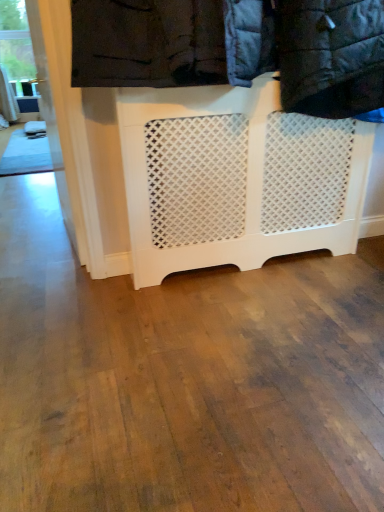
What do you see at coordinates (16, 41) in the screenshot? The image size is (384, 512). I see `clear glass window at upper left` at bounding box center [16, 41].

What do you see at coordinates (238, 49) in the screenshot? The height and width of the screenshot is (512, 384). I see `white lattice laundry at upper center` at bounding box center [238, 49].

This screenshot has height=512, width=384. Identify the location of white lattice radiator at center. (223, 182).

Is white lattice laundry at upper center touching clear glass window at upper left?

white lattice laundry at upper center is not next to clear glass window at upper left, and they're not touching.

From the image's perspective, does white lattice laundry at upper center appear lower than clear glass window at upper left?

Yes, from the image's perspective, white lattice laundry at upper center is below clear glass window at upper left.

Is white lattice laundry at upper center inside the boundaries of clear glass window at upper left, or outside?

white lattice laundry at upper center is not inside clear glass window at upper left, it's outside.

Which is more to the right, white lattice laundry at upper center or clear glass window at upper left?

Positioned to the right is white lattice laundry at upper center.

Based on their positions, is white lattice radiator at center located to the left or right of white lattice laundry at upper center?

white lattice radiator at center is positioned on white lattice laundry at upper center's left side.

Can you confirm if white lattice radiator at center is smaller than white lattice laundry at upper center?

Yes, white lattice radiator at center is smaller than white lattice laundry at upper center.

In terms of width, does white lattice radiator at center look wider or thinner when compared to white lattice laundry at upper center?

white lattice radiator at center is thinner than white lattice laundry at upper center.

From the image's perspective, does white lattice radiator at center appear lower than clear glass window at upper left?

Indeed, from the image's perspective, white lattice radiator at center is shown beneath clear glass window at upper left.

Between point (313, 182) and point (18, 45), which one is positioned behind?

Positioned behind is point (18, 45).

Based on the photo, is white lattice radiator at center in contact with clear glass window at upper left?

No, white lattice radiator at center is not touching clear glass window at upper left.

You are a GUI agent. You are given a task and a screenshot of the screen. Output one action in this format:
    pyautogui.click(x=<x>, y=<y>)
    Task: Click on the furniture on the right of the clear glass window at upper left
    Image resolution: width=384 pixels, height=512 pixels.
    Given the screenshot: What is the action you would take?
    pyautogui.click(x=223, y=182)

From a real-world perspective, is clear glass window at upper left positioned above or below white lattice radiator at center?

From a real-world perspective, clear glass window at upper left is physically above white lattice radiator at center.

Is point (11, 14) behind point (340, 151)?

Yes, point (11, 14) is farther from viewer.

Considering their positions, is clear glass window at upper left located in front of or behind white lattice radiator at center?

In the image, clear glass window at upper left appears behind white lattice radiator at center.

Considering the sizes of clear glass window at upper left and white lattice radiator at center in the image, is clear glass window at upper left wider or thinner than white lattice radiator at center?

In the image, clear glass window at upper left appears to be wider than white lattice radiator at center.

Would you say clear glass window at upper left is outside white lattice laundry at upper center?

Yes, clear glass window at upper left is located beyond the bounds of white lattice laundry at upper center.

This screenshot has width=384, height=512. Identify the location of window frame to the left of white lattice laundry at upper center. point(16,41).

How many degrees apart are the facing directions of clear glass window at upper left and white lattice laundry at upper center?

0.715 degrees.

Is white lattice laundry at upper center to the left or to the right of white lattice radiator at center in the image?

white lattice laundry at upper center is to the right of white lattice radiator at center.

From a real-world perspective, is white lattice laundry at upper center above or below white lattice radiator at center?

From a real-world perspective, white lattice laundry at upper center is physically above white lattice radiator at center.

Does white lattice laundry at upper center have a lesser width compared to white lattice radiator at center?

No.

Find the location of a particular element. laundry on the right of the clear glass window at upper left is located at coordinates (238, 49).

Locate an element on the screen. The height and width of the screenshot is (512, 384). furniture that appears on the left of white lattice laundry at upper center is located at coordinates (223, 182).

Estimate the real-world distances between objects in this image. Which object is closer to clear glass window at upper left, white lattice laundry at upper center or white lattice radiator at center?

Based on the image, white lattice radiator at center appears to be nearer to clear glass window at upper left.

Considering their positions, is clear glass window at upper left positioned further to white lattice radiator at center than white lattice laundry at upper center?

clear glass window at upper left lies further to white lattice radiator at center than the other object.

From the image, which object appears to be nearer to clear glass window at upper left, white lattice radiator at center or white lattice laundry at upper center?

white lattice radiator at center.

Considering their positions, is clear glass window at upper left positioned closer to white lattice laundry at upper center than white lattice radiator at center?

white lattice radiator at center lies closer to white lattice laundry at upper center than the other object.

Looking at the image, which one is located closer to white lattice radiator at center, white lattice laundry at upper center or clear glass window at upper left?

Based on the image, white lattice laundry at upper center appears to be nearer to white lattice radiator at center.

Looking at the image, which one is located further to white lattice laundry at upper center, white lattice radiator at center or clear glass window at upper left?

clear glass window at upper left lies further to white lattice laundry at upper center than the other object.

Where is `furniture located between white lattice laundry at upper center and clear glass window at upper left in the depth direction`? The image size is (384, 512). furniture located between white lattice laundry at upper center and clear glass window at upper left in the depth direction is located at coordinates (223, 182).